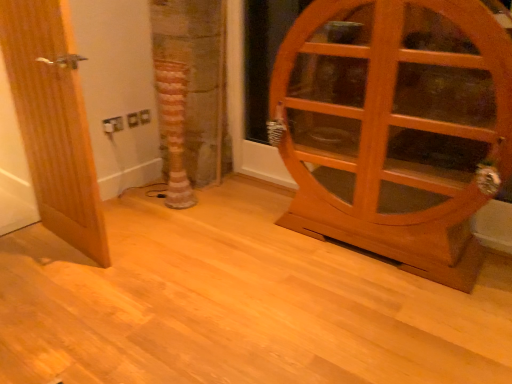
You are a GUI agent. You are given a task and a screenshot of the screen. Output one action in this format:
    pyautogui.click(x=<x>, y=<y>)
    Task: Click on the vacant area that is situated to the right of wooden door at left, which is counted as the 1th door, starting from the left
    The width and height of the screenshot is (512, 384).
    Given the screenshot: What is the action you would take?
    pyautogui.click(x=151, y=248)